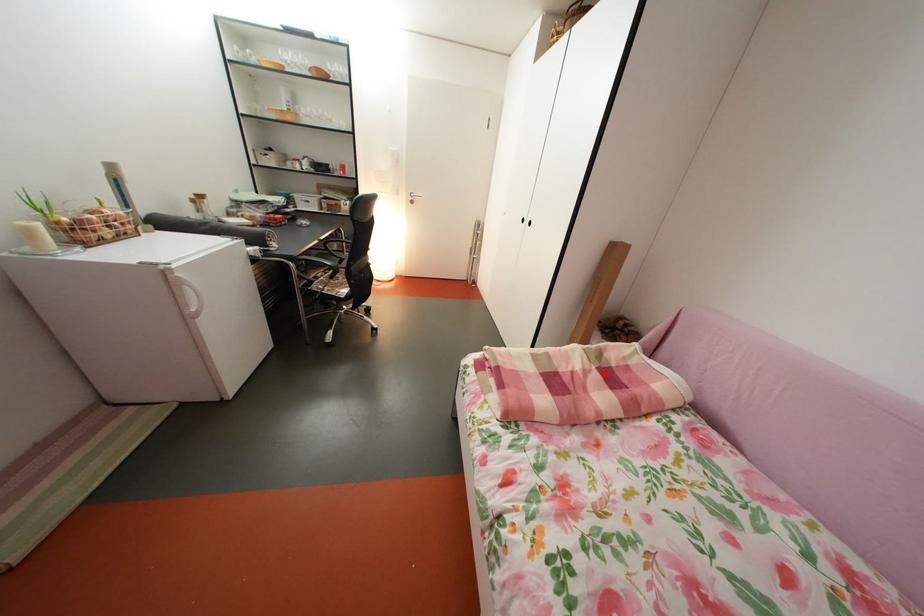
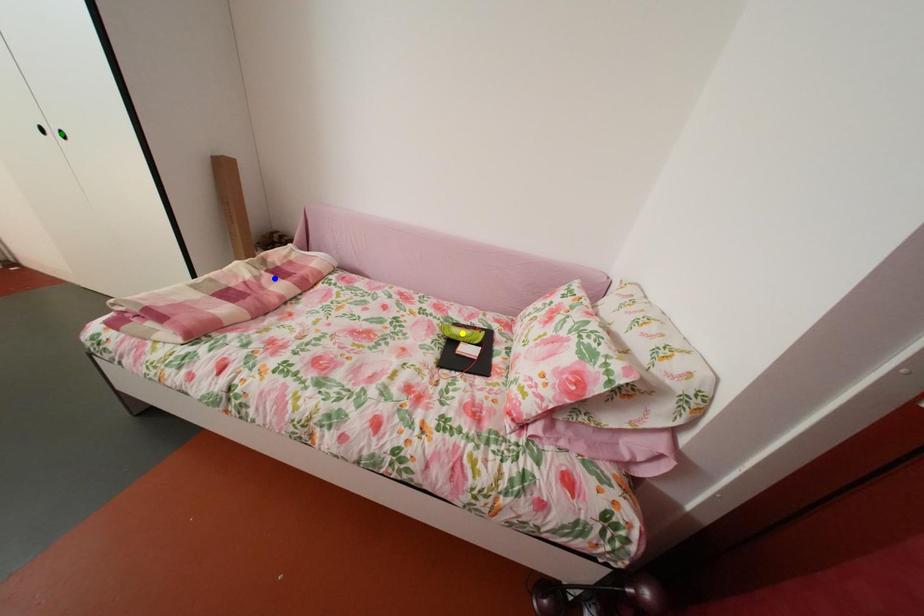
Question: I am providing you with two images of the same scene from different viewpoints. A red point is marked on the first image. You are given multiple points on the second image. Which point in image 2 is actually the same real-world point as the red point in image 1?

Choices:
 (A) green point
 (B) blue point
 (C) yellow point

Answer: (B)